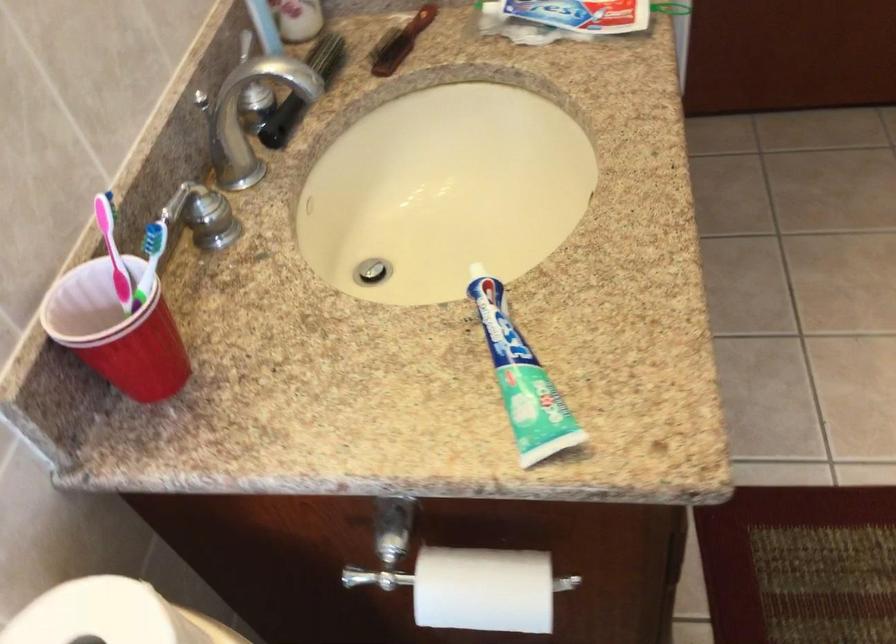
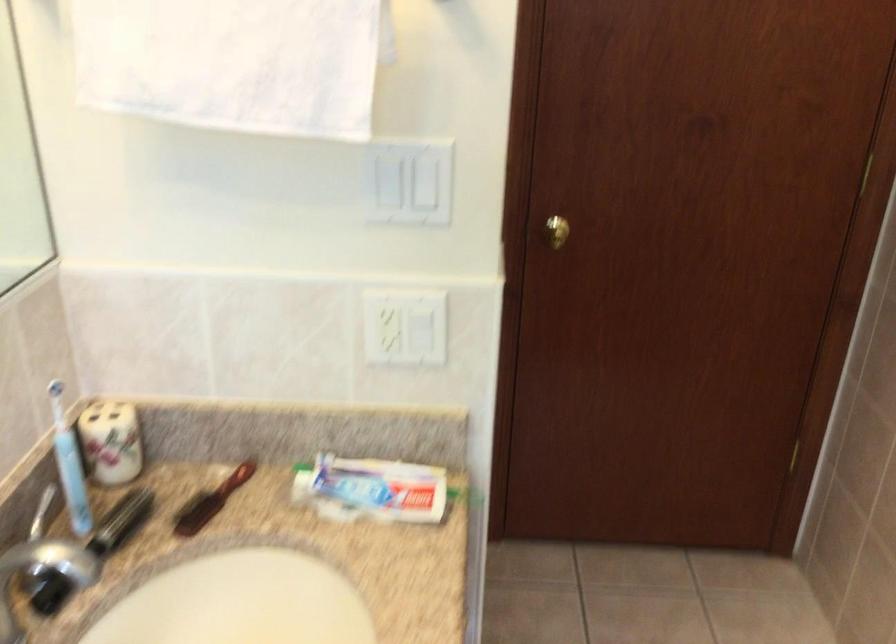
What movement of the cameraman would produce the second image?

The cameraman walked toward right, backward.